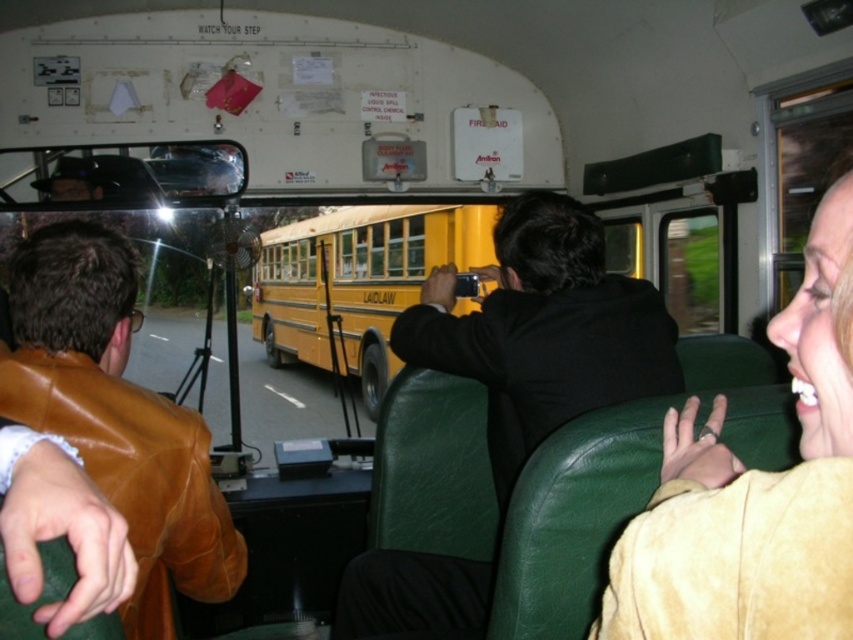
You are a passenger sitting in the bus and you want to pick up the black matte jacket at center. Can you reach it without leaving your seat?

The black matte jacket at center is 1.46 meters away from the viewer, so you cannot reach it without leaving your seat.

Consider the image. You are a passenger on the bus and want to retrieve your jacket from the seat. You remember placing your black matte jacket at center on the seat. However, there is a light beige suede jacket at right in the way. Based on their positions, which jacket is closer to the aisle so you can reach it first without disturbing the other?

The light beige suede jacket at right is to the right of the black matte jacket at center, so it is closer to the aisle. You can reach it first without disturbing the other jacket.